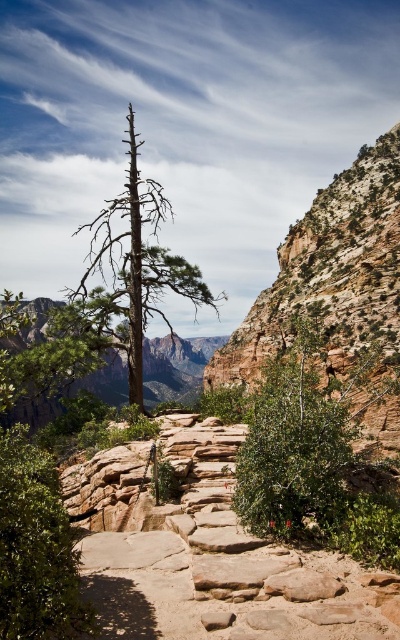
Question: From the image, what is the correct spatial relationship of green leafy bush at center in relation to green leafy tree at left?

Choices:
 (A) below
 (B) above

Answer: (A)

Question: Does green leafy bush at center have a larger size compared to green leafy tree at left?

Choices:
 (A) no
 (B) yes

Answer: (A)

Question: Among these points, which one is nearest to the camera?

Choices:
 (A) (8, 582)
 (B) (96, 228)

Answer: (A)

Question: Is green leafy tree at left closer to the viewer compared to brown textured tree at center?

Choices:
 (A) no
 (B) yes

Answer: (B)

Question: Which of the following is the farthest from the observer?

Choices:
 (A) green leafy bush at center
 (B) brown textured tree at center
 (C) green leafy tree at left

Answer: (B)

Question: Which of the following is the closest to the observer?

Choices:
 (A) (30, 596)
 (B) (276, 458)

Answer: (A)